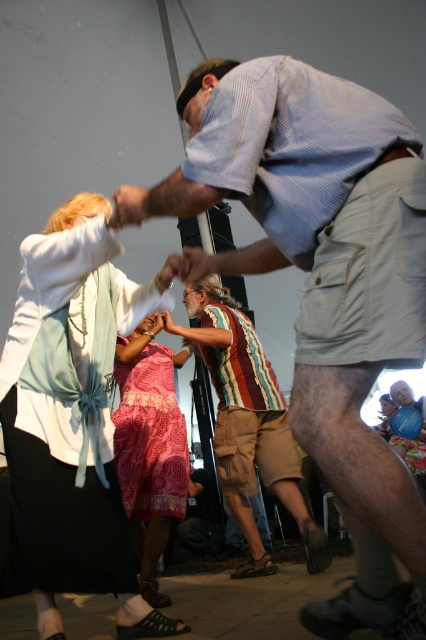
Question: Which object appears closest to the camera in this image?

Choices:
 (A) striped fabric shirt at center
 (B) smooth skin hand at center

Answer: (B)

Question: Is striped fabric shirt at center above pink textured dress at center?

Choices:
 (A) no
 (B) yes

Answer: (A)

Question: Which of the following is the farthest from the observer?

Choices:
 (A) (195, 248)
 (B) (65, 404)
 (C) (382, 426)

Answer: (C)

Question: Which point appears farthest from the camera in this image?

Choices:
 (A) (149, 419)
 (B) (293, 228)

Answer: (A)

Question: Considering the relative positions of blue striped shirt at upper center and pink fabric dress at center in the image provided, where is blue striped shirt at upper center located with respect to pink fabric dress at center?

Choices:
 (A) above
 (B) below

Answer: (A)

Question: Does striped fabric shirt at center appear over pink fabric dress at center?

Choices:
 (A) no
 (B) yes

Answer: (B)